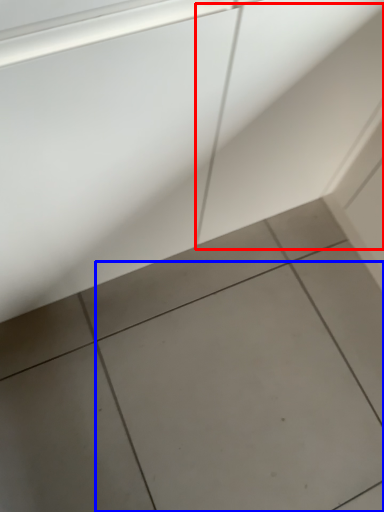
Question: Which object appears closest to the camera in this image, concrete (highlighted by a red box) or ceramic tile (highlighted by a blue box)?

Choices:
 (A) concrete
 (B) ceramic tile

Answer: (A)